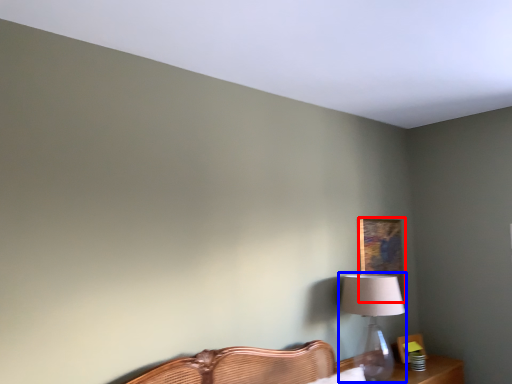
Question: Which object appears closest to the camera in this image, picture frame (highlighted by a red box) or table lamp (highlighted by a blue box)?

Choices:
 (A) picture frame
 (B) table lamp

Answer: (B)